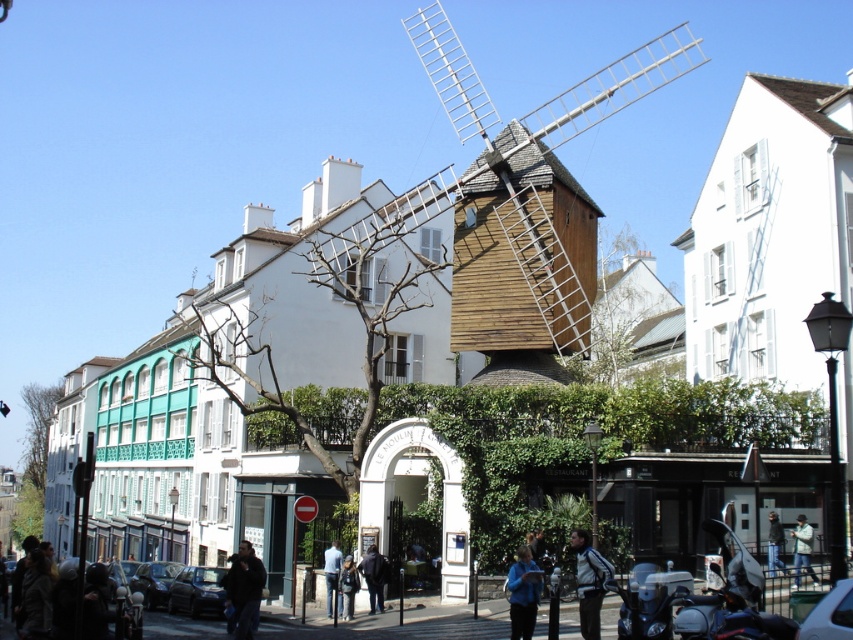
You are a fashion designer observing a street scene in a European town. You notice two blue garments in the image. Which one is taller, the blue fabric jacket at lower center or the blue shirt at center?

The blue fabric jacket at lower center is taller than the blue shirt at center.

You are standing at the center of the street in the image. You see a dark blue jacket at lower left. Where is the point at coordinate (244, 589) located?

The point at coordinate (244, 589) is located on the dark blue jacket at lower left.